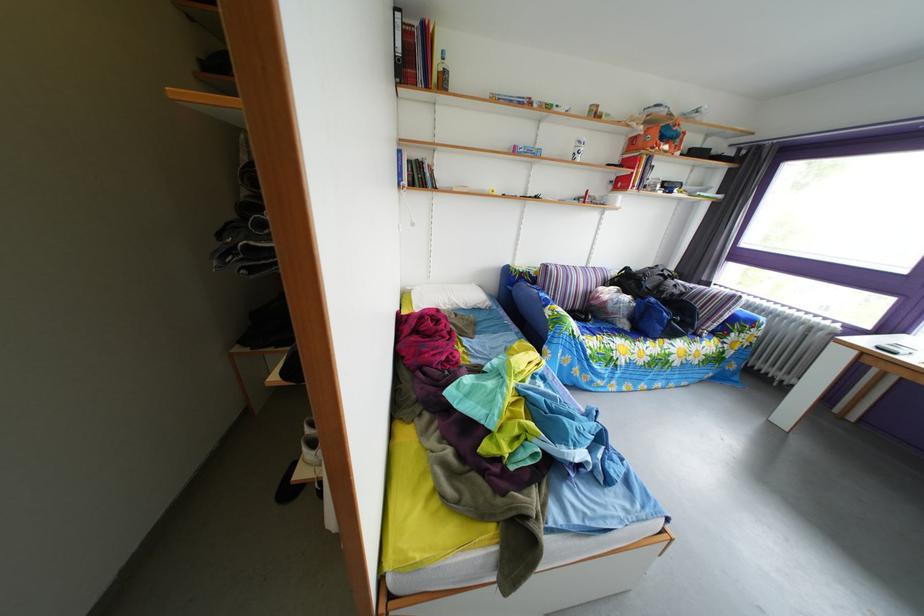
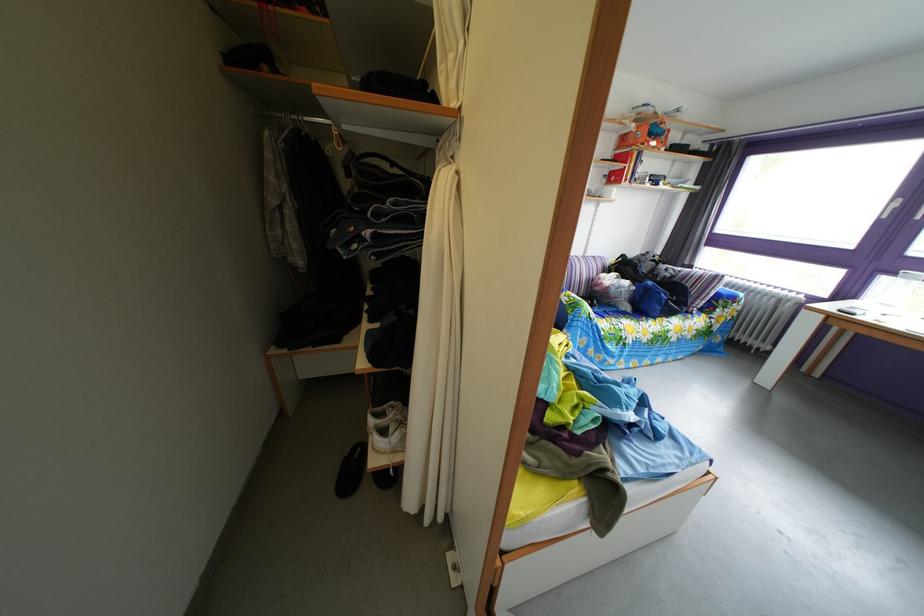
Find the pixel in the second image that matches [319,439] in the first image.

(383, 430)